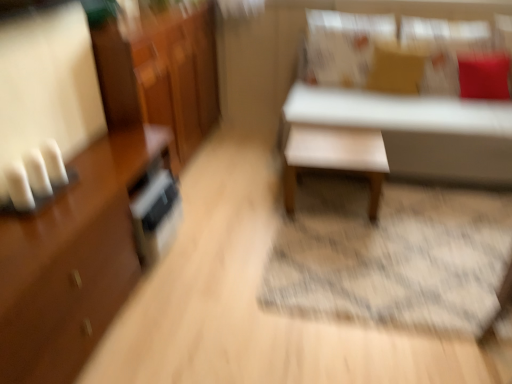
Identify the location of vacant area located to the right-hand side of smooth beige table at center, the second table positioned from the right. The height and width of the screenshot is (384, 512). (415, 206).